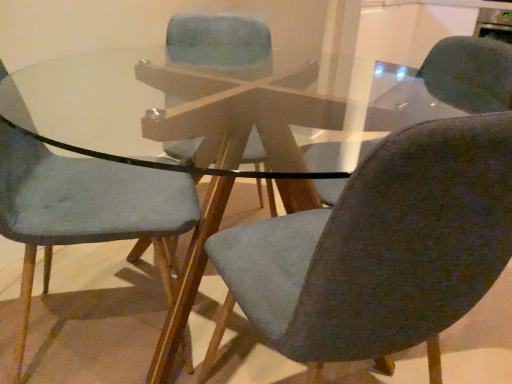
Question: Does textured fabric chair at center, placed as the second chair when sorted from left to right, come in front of textured gray chair at center, the third chair in the left-to-right sequence?

Choices:
 (A) no
 (B) yes

Answer: (A)

Question: Is textured fabric chair at center, marked as the 2th chair in a right-to-left arrangement, oriented towards textured gray chair at center, marked as the 1th chair in a right-to-left arrangement?

Choices:
 (A) yes
 (B) no

Answer: (A)

Question: From the image's perspective, is textured fabric chair at center, marked as the 2th chair in a right-to-left arrangement, under textured gray chair at center, the third chair in the left-to-right sequence?

Choices:
 (A) no
 (B) yes

Answer: (A)

Question: Does textured fabric chair at center, placed as the second chair when sorted from left to right, have a lesser width compared to textured gray chair at center, marked as the 1th chair in a right-to-left arrangement?

Choices:
 (A) no
 (B) yes

Answer: (B)

Question: Is textured fabric chair at center, marked as the 2th chair in a right-to-left arrangement, smaller than textured gray chair at center, the third chair in the left-to-right sequence?

Choices:
 (A) yes
 (B) no

Answer: (A)

Question: From the image's perspective, is textured fabric chair at center, marked as the 2th chair in a right-to-left arrangement, above or below matte gray chair at left, the 3th chair from the right?

Choices:
 (A) above
 (B) below

Answer: (A)

Question: From a real-world perspective, relative to matte gray chair at left, the 3th chair from the right, is textured fabric chair at center, placed as the second chair when sorted from left to right, vertically above or below?

Choices:
 (A) above
 (B) below

Answer: (A)

Question: Would you say textured fabric chair at center, placed as the second chair when sorted from left to right, is to the left or to the right of matte gray chair at left, the 1th chair positioned from the left, in the picture?

Choices:
 (A) left
 (B) right

Answer: (B)

Question: Does point (185, 13) appear closer or farther from the camera than point (55, 215)?

Choices:
 (A) farther
 (B) closer

Answer: (A)

Question: Is matte gray chair at left, the 3th chair from the right, to the left or to the right of textured gray chair at center, marked as the 1th chair in a right-to-left arrangement, in the image?

Choices:
 (A) right
 (B) left

Answer: (B)

Question: From a real-world perspective, is matte gray chair at left, the 1th chair positioned from the left, physically located above or below textured gray chair at center, marked as the 1th chair in a right-to-left arrangement?

Choices:
 (A) below
 (B) above

Answer: (B)

Question: Considering the positions of point [x=84, y=160] and point [x=367, y=246], is point [x=84, y=160] closer or farther from the camera than point [x=367, y=246]?

Choices:
 (A) closer
 (B) farther

Answer: (B)

Question: Is matte gray chair at left, the 1th chair positioned from the left, taller or shorter than textured gray chair at center, the third chair in the left-to-right sequence?

Choices:
 (A) short
 (B) tall

Answer: (B)

Question: Considering the positions of point (372, 301) and point (169, 46), is point (372, 301) closer or farther from the camera than point (169, 46)?

Choices:
 (A) closer
 (B) farther

Answer: (A)

Question: From a real-world perspective, relative to textured fabric chair at center, marked as the 2th chair in a right-to-left arrangement, is textured gray chair at center, marked as the 1th chair in a right-to-left arrangement, vertically above or below?

Choices:
 (A) below
 (B) above

Answer: (A)